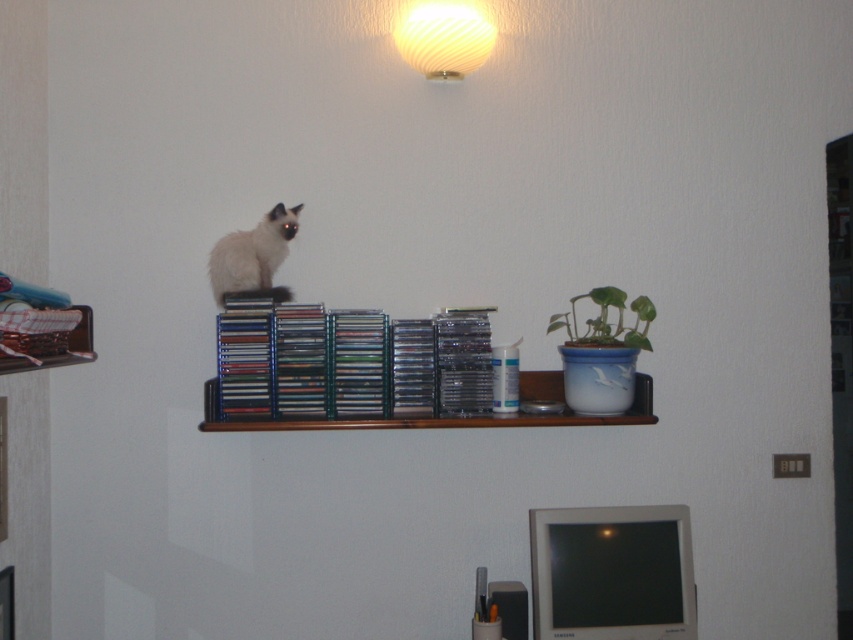
Measure the distance from brown wooden shelf at center to smokey white fur at upper center.

brown wooden shelf at center is 12.73 inches from smokey white fur at upper center.

Does brown wooden shelf at center have a smaller size compared to smokey white fur at upper center?

Incorrect, brown wooden shelf at center is not smaller in size than smokey white fur at upper center.

Who is more forward, (293,422) or (259,240)?

Point (293,422)

Where is `brown wooden shelf at center`? The height and width of the screenshot is (640, 853). brown wooden shelf at center is located at coordinates (428, 417).

Can you confirm if brown wooden shelf at center is positioned to the left of green glossy leafy plant at upper right?

Yes, brown wooden shelf at center is to the left of green glossy leafy plant at upper right.

Between point (526, 374) and point (639, 305), which one is positioned in front?

Point (639, 305) is in front.

Locate an element on the screen. This screenshot has height=640, width=853. brown wooden shelf at center is located at coordinates (428, 417).

The height and width of the screenshot is (640, 853). Identify the location of brown wooden shelf at center. (428, 417).

Is white ribbed glass lamp at upper center smaller than smokey white fur at upper center?

Incorrect, white ribbed glass lamp at upper center is not smaller in size than smokey white fur at upper center.

Does point (451, 65) come behind point (277, 262)?

No.

Who is more distant from viewer, (413, 49) or (231, 234)?

Positioned behind is point (231, 234).

At what (x,y) coordinates should I click in order to perform the action: click on white ribbed glass lamp at upper center. Please return your answer as a coordinate pair (x, y). This screenshot has width=853, height=640. Looking at the image, I should click on (444, 38).